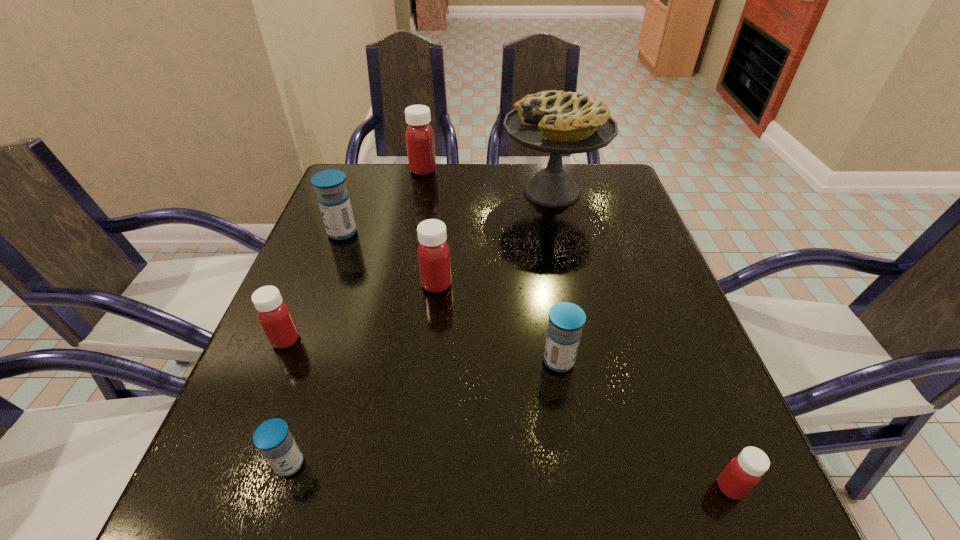
Locate an element on the screen. Image resolution: width=960 pixels, height=540 pixels. the tallest object is located at coordinates (557, 122).

I want to click on the biggest red medicine, so click(x=419, y=135).

The height and width of the screenshot is (540, 960). I want to click on the farthest red medicine, so click(419, 135).

Where is `the farthest blue medicine`? This screenshot has width=960, height=540. the farthest blue medicine is located at coordinates (333, 198).

Where is `the biggest blue medicine`? the biggest blue medicine is located at coordinates (333, 198).

Locate an element on the screen. the fourth farthest object is located at coordinates (433, 252).

Where is `the fifth medicine from left to right`? Image resolution: width=960 pixels, height=540 pixels. the fifth medicine from left to right is located at coordinates (433, 252).

Find the location of a particular element. The image size is (960, 540). the second smallest red medicine is located at coordinates (274, 315).

Identify the location of the second nearest red medicine. This screenshot has width=960, height=540. (274, 315).

Find the location of a particular element. the second biggest blue medicine is located at coordinates (566, 320).